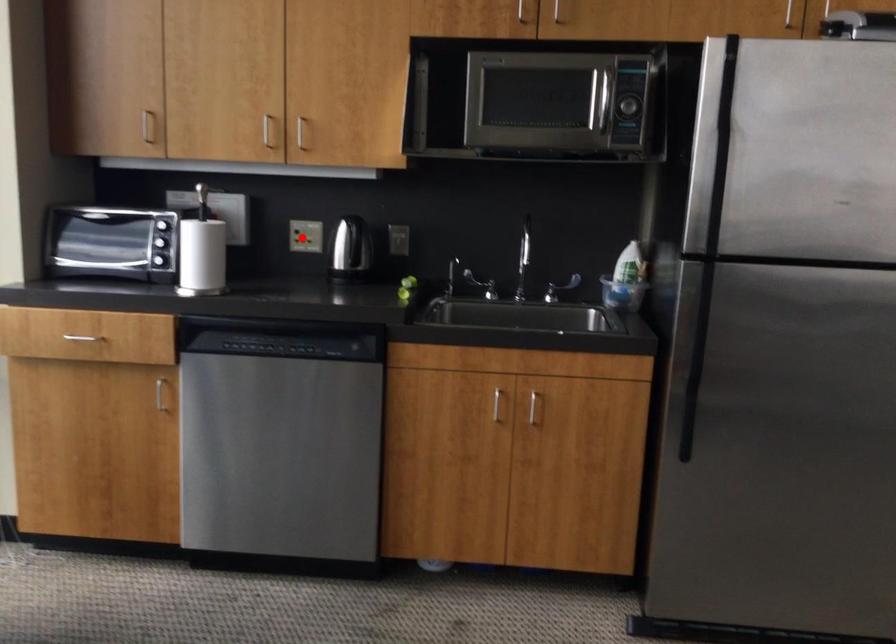
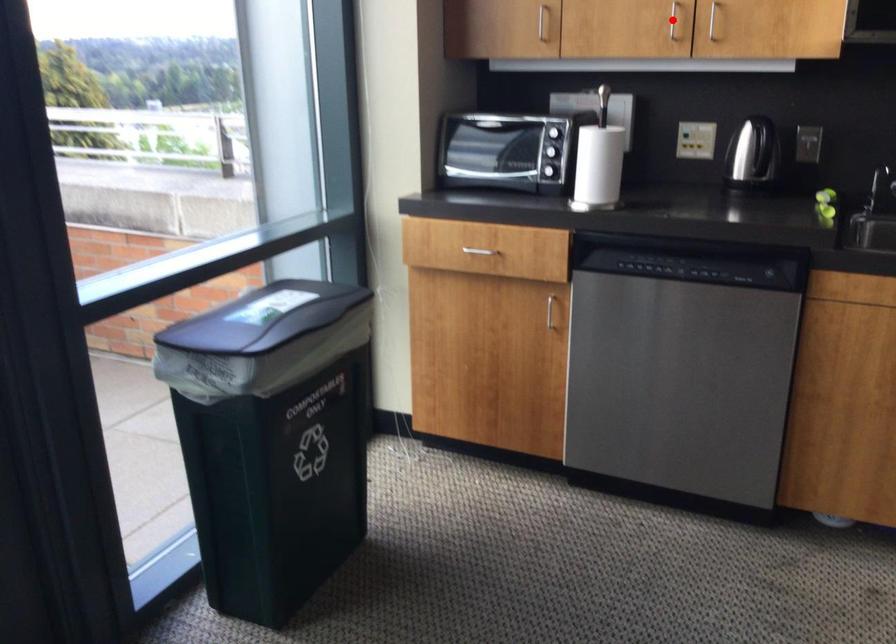
I am providing you with two images of the same scene from different viewpoints. A red point is marked on the first image and another point is marked on the second image. Is the red point in image1 aligned with the point shown in image2?

No